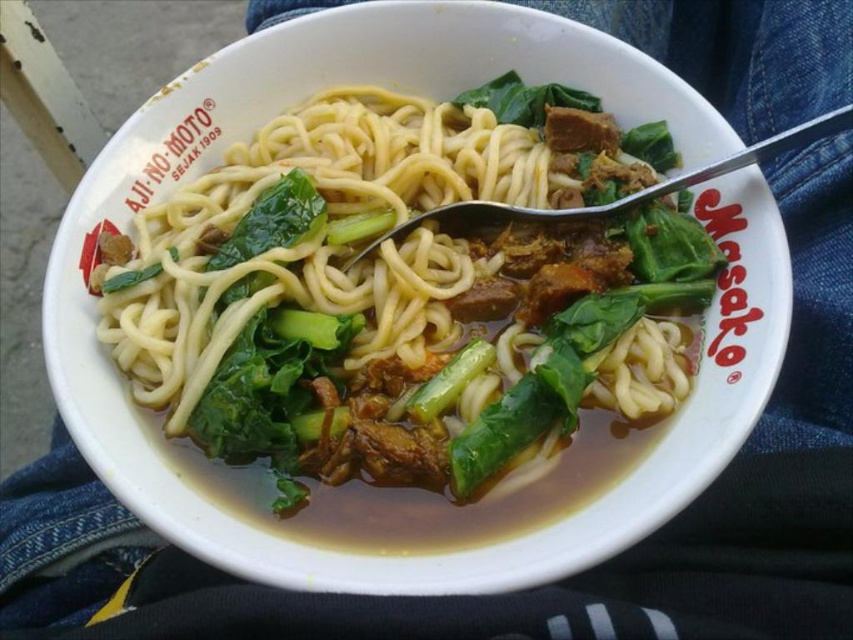
Looking at the bowl of noodle soup, where exactly are the yellow matte noodles at center in relation to the green leafy vegetable at center?

The yellow matte noodles at center are to the left of the green leafy vegetable at center.

You are a food critic evaluating the presentation of this noodle soup. Based on the size comparison between the yellow matte noodles at center and the green leafy vegetable at center, which ingredient takes up more space in the bowl?

The yellow matte noodles at center has a larger size compared to the green leafy vegetable at center, so the noodles take up more space in the bowl.

You are a food critic who needs to describe the arrangement of the ingredients in the bowl. How far apart are the yellow matte noodles at center and the green leafy vegetable at center?

The distance between the yellow matte noodles at center and the green leafy vegetable at center is 11.59 inches.